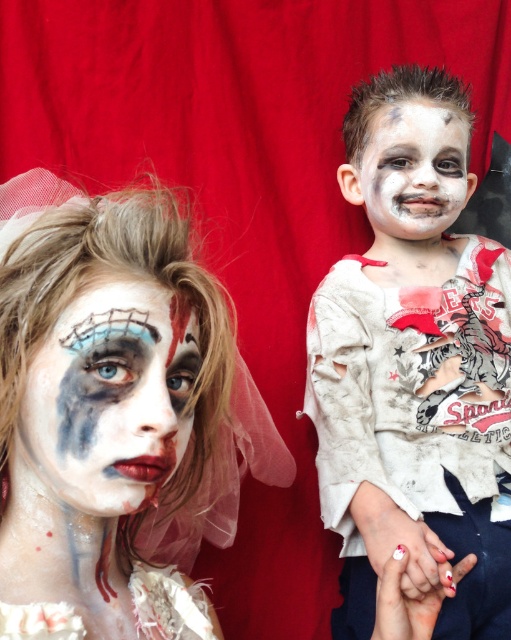
You are a makeup artist analyzing two faces in the image. The first has matte white face paint at center, and the other has matte painted face at center. Which of these two has a wider area of matte face paint?

The matte white face paint at center has a wider area than the matte painted face at center.

You are a costume designer preparing for a theater performance. You have two white matte items available for the character on the right side of the stage. One is the white matte shirt at right and the other is the white matte face paint at upper right. Which item has a larger size?

The white matte shirt at right is bigger than the white matte face paint at upper right, so the shirt is the larger item.